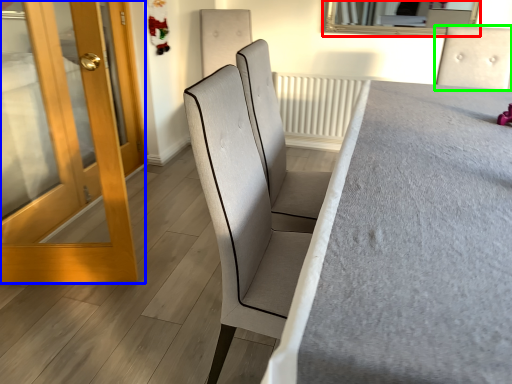
Question: Based on their relative distances, which object is farther from mirror (highlighted by a red box)? Choose from door (highlighted by a blue box) and chair (highlighted by a green box).

Choices:
 (A) door
 (B) chair

Answer: (A)